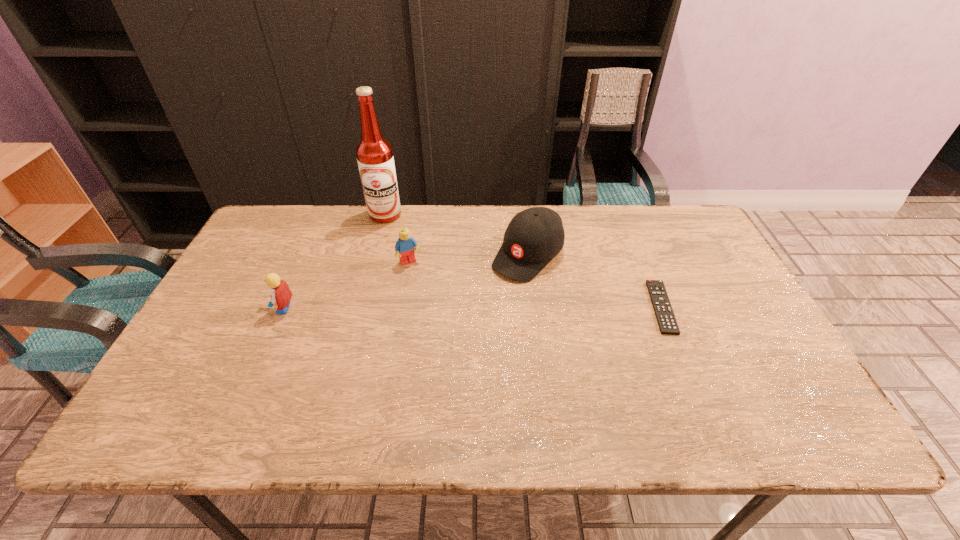
Where is `free space located 0.380m on the face of the right Lego`? free space located 0.380m on the face of the right Lego is located at coordinates (469, 364).

Find the location of a particular element. Image resolution: width=960 pixels, height=540 pixels. baseball cap that is positioned at the far edge is located at coordinates (534, 236).

At what (x,y) coordinates should I click in order to perform the action: click on alcohol located at the far edge. Please return your answer as a coordinate pair (x, y). The image size is (960, 540). Looking at the image, I should click on (374, 153).

This screenshot has width=960, height=540. In order to click on object at the left edge in this screenshot , I will do `click(280, 293)`.

In the image, there is a desktop. Identify the location of vacant space at the far edge. 449,237.

Find the location of a particular element. The image size is (960, 540). free space at the near edge of the desktop is located at coordinates (376, 385).

The height and width of the screenshot is (540, 960). In the image, there is a desktop. In order to click on vacant space at the left edge in this screenshot , I will do `click(240, 341)`.

The width and height of the screenshot is (960, 540). What are the coordinates of `free space at the right edge of the desktop` in the screenshot? It's located at click(687, 287).

The height and width of the screenshot is (540, 960). In the image, there is a desktop. In order to click on vacant area at the far left corner in this screenshot , I will do `click(299, 215)`.

The width and height of the screenshot is (960, 540). Identify the location of vacant space at the near right corner of the desktop. (801, 394).